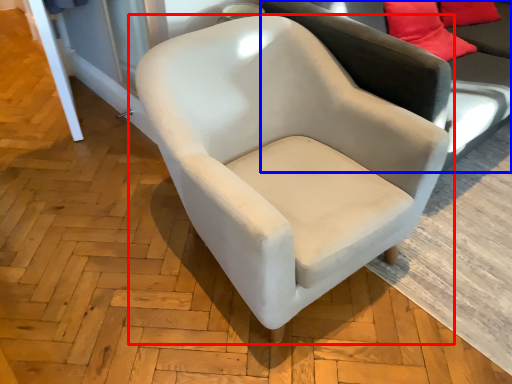
Question: Which object appears closest to the camera in this image, chair (highlighted by a red box) or studio couch (highlighted by a blue box)?

Choices:
 (A) chair
 (B) studio couch

Answer: (A)